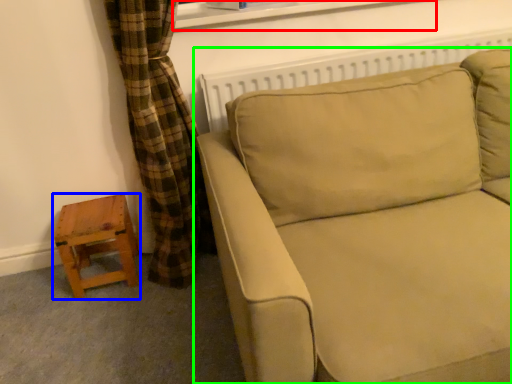
Question: Considering the real-world distances, which object is closest to window frame (highlighted by a red box)? stool (highlighted by a blue box) or studio couch (highlighted by a green box).

Choices:
 (A) stool
 (B) studio couch

Answer: (B)